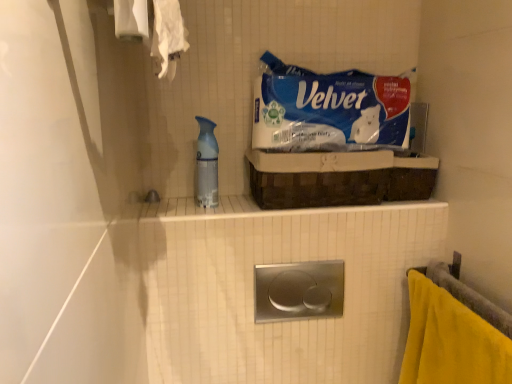
The image size is (512, 384). Identify the location of vacant area situated below blue paper towel at upper center (from a real-world perspective). (x=331, y=148).